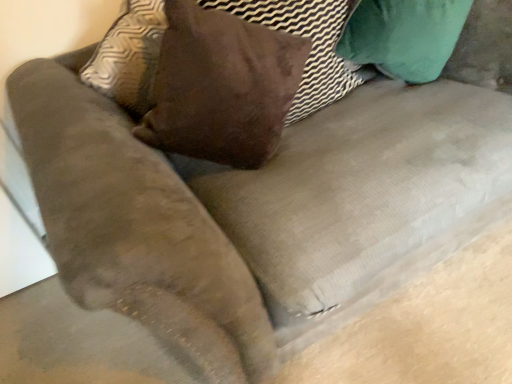
Question: Is brown suede pillow at upper center far from suede brown pillow at center?

Choices:
 (A) no
 (B) yes

Answer: (A)

Question: Is brown suede pillow at upper center to the left of suede brown pillow at center from the viewer's perspective?

Choices:
 (A) no
 (B) yes

Answer: (B)

Question: From a real-world perspective, is brown suede pillow at upper center under suede brown pillow at center?

Choices:
 (A) no
 (B) yes

Answer: (A)

Question: From a real-world perspective, does brown suede pillow at upper center stand above suede brown pillow at center?

Choices:
 (A) no
 (B) yes

Answer: (B)

Question: Does brown suede pillow at upper center touch suede brown pillow at center?

Choices:
 (A) no
 (B) yes

Answer: (A)

Question: Does brown suede pillow at upper center contain suede brown pillow at center?

Choices:
 (A) yes
 (B) no

Answer: (B)

Question: Is suede brown pillow at center closer to camera compared to brown suede pillow at upper center?

Choices:
 (A) no
 (B) yes

Answer: (A)

Question: Does suede brown pillow at center have a greater width compared to brown suede pillow at upper center?

Choices:
 (A) yes
 (B) no

Answer: (B)

Question: Would you say suede brown pillow at center contains brown suede pillow at upper center?

Choices:
 (A) yes
 (B) no

Answer: (B)

Question: Is suede brown pillow at center next to brown suede pillow at upper center?

Choices:
 (A) yes
 (B) no

Answer: (B)

Question: Can you confirm if suede brown pillow at center is positioned to the right of brown suede pillow at upper center?

Choices:
 (A) no
 (B) yes

Answer: (B)

Question: Considering the relative sizes of suede brown pillow at center and brown suede pillow at upper center in the image provided, is suede brown pillow at center taller than brown suede pillow at upper center?

Choices:
 (A) no
 (B) yes

Answer: (A)

Question: From a real-world perspective, is suede brown pillow at center physically located above or below brown suede pillow at upper center?

Choices:
 (A) above
 (B) below

Answer: (B)